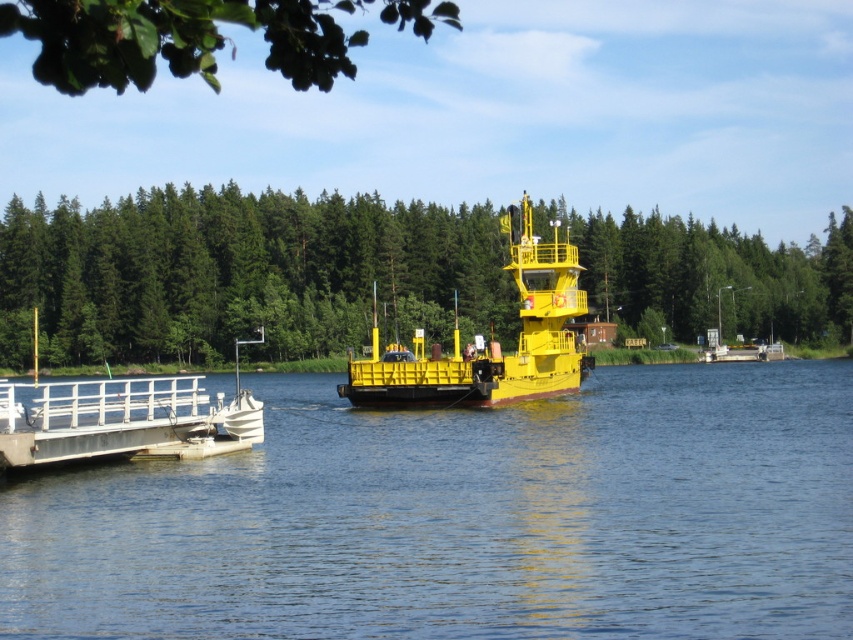
Between green leafy branch at upper left and yellow matte boat at center, which one has less height?

yellow matte boat at center is shorter.

Where is `green leafy branch at upper left`? green leafy branch at upper left is located at coordinates (196, 36).

Find the location of a particular element. The image size is (853, 640). green leafy branch at upper left is located at coordinates (196, 36).

Can you confirm if blue water at center is shorter than green leafy trees at center?

Indeed, blue water at center has a lesser height compared to green leafy trees at center.

Does point (714, 440) lie in front of point (380, 220)?

Yes, point (714, 440) is closer to viewer.

Image resolution: width=853 pixels, height=640 pixels. What are the coordinates of `blue water at center` in the screenshot? It's located at (465, 518).

Locate an element on the screen. blue water at center is located at coordinates (465, 518).

Does green leafy trees at center appear under yellow matte boat at center?

No.

Which is more to the right, green leafy trees at center or yellow matte boat at center?

From the viewer's perspective, green leafy trees at center appears more on the right side.

In order to click on green leafy trees at center in this screenshot , I will do `click(238, 273)`.